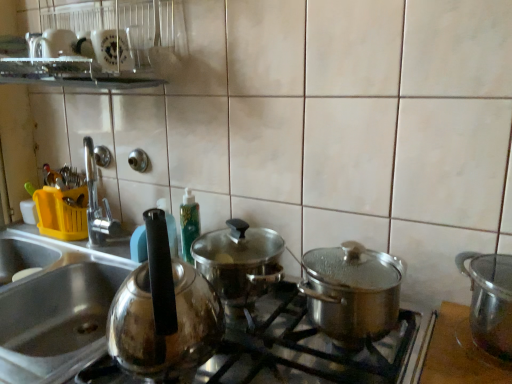
Question: Would you say shiny metallic pot at right, which is the 1th kitchen appliance from right to left, is inside or outside satin silver sink at left?

Choices:
 (A) outside
 (B) inside

Answer: (A)

Question: From a real-world perspective, is shiny metallic pot at right, the 2th kitchen appliance when ordered from left to right, positioned above or below satin silver sink at left?

Choices:
 (A) above
 (B) below

Answer: (A)

Question: Which of these objects is positioned closest to the shiny metallic pot at right, the 2th kitchen appliance when ordered from left to right?

Choices:
 (A) satin silver sink at left
 (B) shiny metallic pot at center, arranged as the 2th kitchen appliance when viewed from the right
 (C) shiny metallic pots at center

Answer: (B)

Question: Estimate the real-world distances between objects in this image. Which object is closer to the satin silver sink at left?

Choices:
 (A) shiny metallic pot at center, arranged as the 2th kitchen appliance when viewed from the right
 (B) shiny metallic pot at right, which is the 1th kitchen appliance from right to left
 (C) shiny metallic pots at center

Answer: (C)